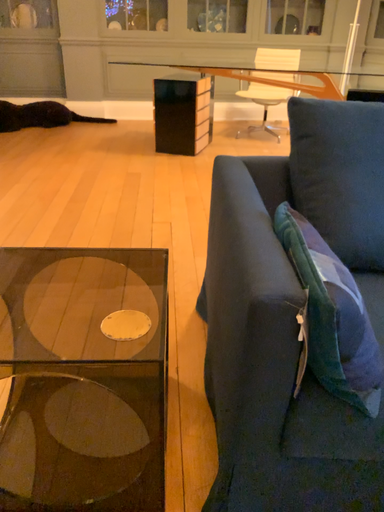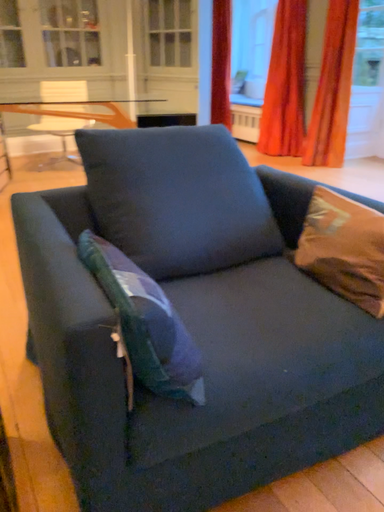
Question: Which way did the camera rotate in the video?

Choices:
 (A) rotated left
 (B) rotated right

Answer: (B)